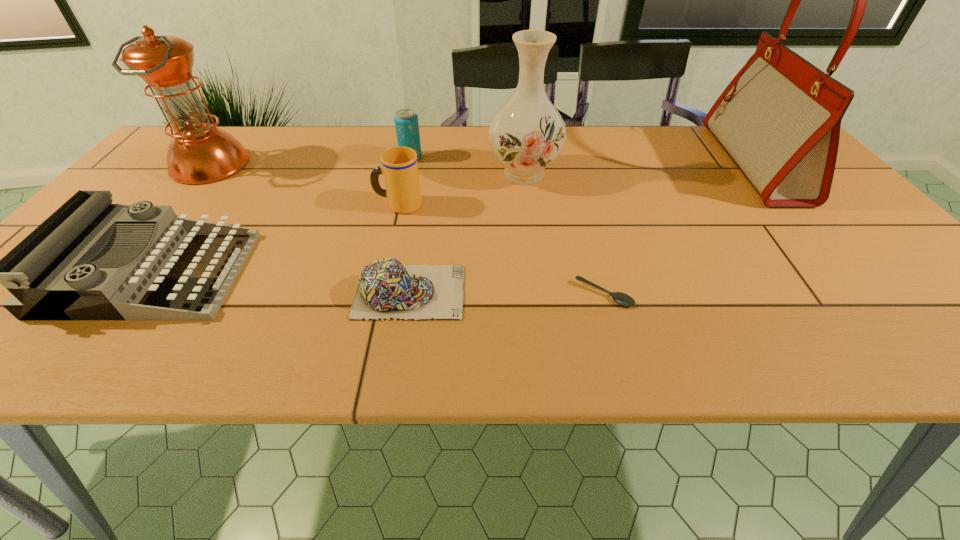
The image size is (960, 540). I want to click on vacant space at the far edge of the desktop, so click(367, 166).

The width and height of the screenshot is (960, 540). I want to click on free region at the near edge of the desktop, so click(x=544, y=353).

Locate an element on the screen. vacant area at the right edge is located at coordinates (813, 213).

Image resolution: width=960 pixels, height=540 pixels. In the image, there is a desktop. Find the location of `vacant space at the near right corner`. vacant space at the near right corner is located at coordinates (927, 332).

Identify the location of vacant region between the handbag and the oil lamp. This screenshot has width=960, height=540. [482, 164].

Identify the location of unoccupied position between the seventh tallest object and the soupspoon. Image resolution: width=960 pixels, height=540 pixels. (507, 293).

At what (x,y) coordinates should I click in order to perform the action: click on free spot between the cap and the cup. Please return your answer as a coordinate pair (x, y). The height and width of the screenshot is (540, 960). Looking at the image, I should click on (404, 248).

Identify the location of vacant space that's between the soupspoon and the rightmost object. (679, 229).

Identify the location of free space between the oil lamp and the shortest object. This screenshot has width=960, height=540. click(407, 230).

At what (x,y) coordinates should I click in order to perform the action: click on vacant space that is in between the rightmost object and the soda can. Please return your answer as a coordinate pair (x, y). The width and height of the screenshot is (960, 540). Looking at the image, I should click on (583, 160).